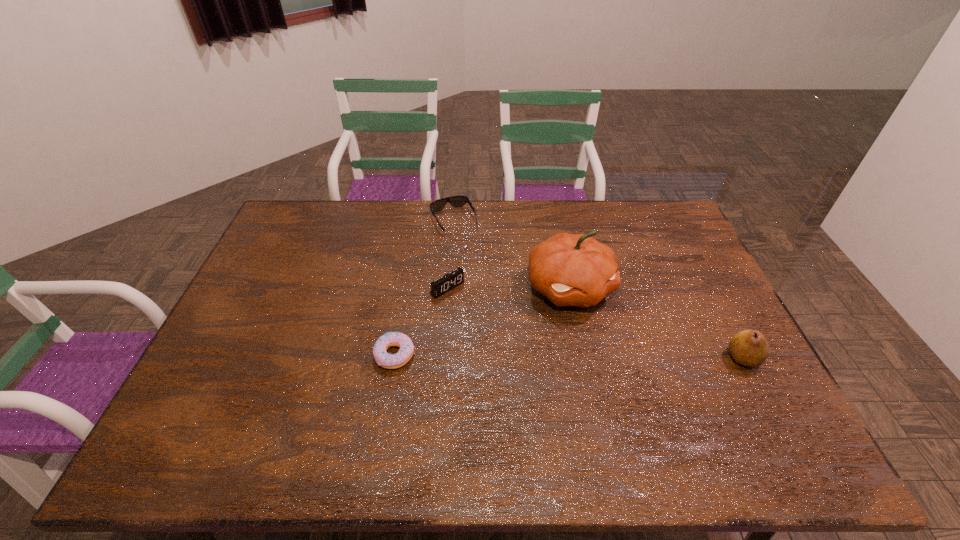
You are a GUI agent. You are given a task and a screenshot of the screen. Output one action in this format:
    pyautogui.click(x=<x>, y=<y>)
    Task: Click on the empty space between the farthest object and the fourth object from left to right
    Image resolution: width=960 pixels, height=540 pixels.
    Given the screenshot: What is the action you would take?
    pyautogui.click(x=512, y=254)

Identify the location of vacant space that's between the farthest object and the second object from right to left. The width and height of the screenshot is (960, 540). (512, 254).

Locate an element on the screen. The image size is (960, 540). free spot between the pumpkin and the doughnut is located at coordinates (482, 321).

This screenshot has height=540, width=960. I want to click on free spot between the doughnut and the alarm clock, so click(421, 321).

Locate an element on the screen. This screenshot has height=540, width=960. object that is the third closest to the alarm clock is located at coordinates (456, 201).

Find the location of a particular element. object that can be found as the third closest to the sunglasses is located at coordinates (382, 358).

Locate an element on the screen. vacant area in the image that satisfies the following two spatial constraints: 1. on the front side of the pumpkin; 2. on the right side of the sunglasses is located at coordinates (448, 287).